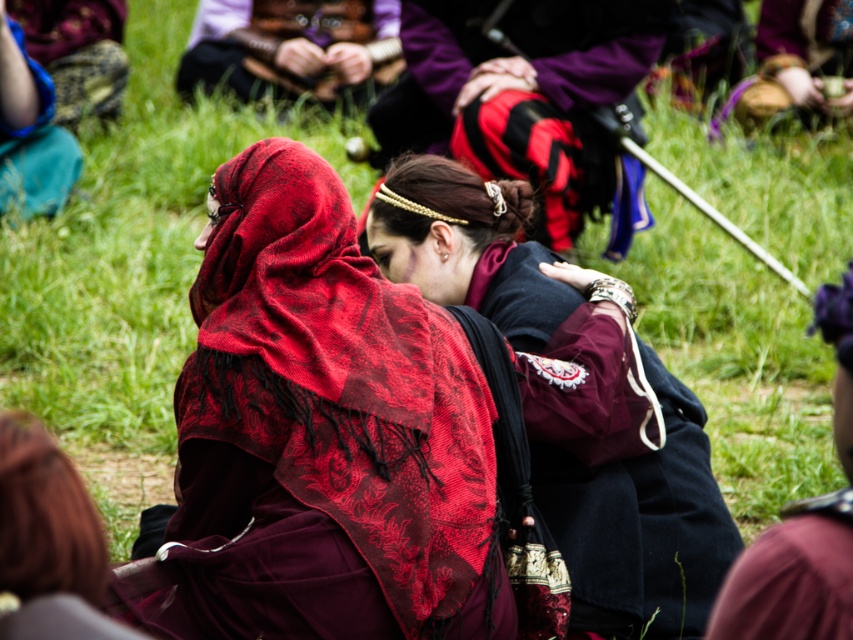
You are a photographer positioned at the back of the scene. You need to capture a photo where both the velvet maroon dress at center and the velvet burgundy dress at center are visible. Which dress should you adjust your camera angle to focus on first to ensure both are in frame?

The velvet maroon dress at center is to the left of the velvet burgundy dress at center, so you should focus on the velvet maroon dress at center first to ensure both are in frame.

Consider the image. You are standing in front of the two costumed individuals in the scene. There are two points marked on the image. One is at coordinates point (x=323, y=524) and the other at point (x=672, y=532). Which of these two points is nearer to you?

Point (x=323, y=524) is closer to the viewer than point (x=672, y=532).